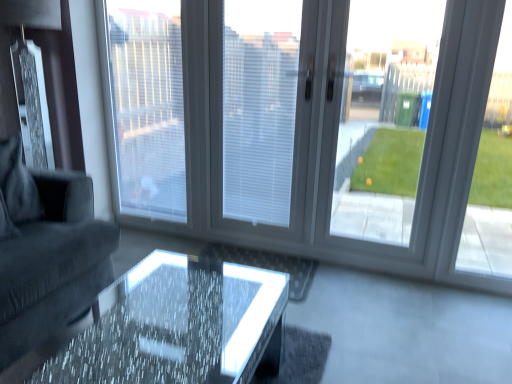
Question: Is transparent glass door at right, arranged as the 3th window screen when viewed from the left, facing away from dark gray fabric couch at left?

Choices:
 (A) no
 (B) yes

Answer: (A)

Question: Can you confirm if transparent glass door at right, arranged as the 3th window screen when viewed from the left, is bigger than dark gray fabric couch at left?

Choices:
 (A) yes
 (B) no

Answer: (B)

Question: Is transparent glass door at right, arranged as the 1th window screen when viewed from the right, wider than dark gray fabric couch at left?

Choices:
 (A) yes
 (B) no

Answer: (B)

Question: Can you confirm if transparent glass door at right, arranged as the 1th window screen when viewed from the right, is thinner than dark gray fabric couch at left?

Choices:
 (A) yes
 (B) no

Answer: (A)

Question: Is the surface of transparent glass door at right, arranged as the 3th window screen when viewed from the left, in direct contact with dark gray fabric couch at left?

Choices:
 (A) yes
 (B) no

Answer: (B)

Question: From the image's perspective, is white plastic window frame at right positioned above or below transparent glass door at right, arranged as the 1th window screen when viewed from the right?

Choices:
 (A) above
 (B) below

Answer: (B)

Question: In the image, is white plastic window frame at right on the left side or the right side of transparent glass door at right, arranged as the 3th window screen when viewed from the left?

Choices:
 (A) left
 (B) right

Answer: (B)

Question: Looking at the image, does white plastic window frame at right seem bigger or smaller compared to transparent glass door at right, arranged as the 1th window screen when viewed from the right?

Choices:
 (A) small
 (B) big

Answer: (A)

Question: Would you say white plastic window frame at right is inside or outside transparent glass door at right, arranged as the 1th window screen when viewed from the right?

Choices:
 (A) outside
 (B) inside

Answer: (A)

Question: Does point (103, 349) appear closer or farther from the camera than point (115, 49)?

Choices:
 (A) farther
 (B) closer

Answer: (B)

Question: In the image, is translucent glass table at center on the left side or the right side of white textured blinds at center, positioned as the 1th window screen in left-to-right order?

Choices:
 (A) left
 (B) right

Answer: (B)

Question: From the image's perspective, is translucent glass table at center located above or below white textured blinds at center, positioned as the 3th window screen in right-to-left order?

Choices:
 (A) above
 (B) below

Answer: (B)

Question: Considering their positions, is translucent glass table at center located in front of or behind white textured blinds at center, positioned as the 3th window screen in right-to-left order?

Choices:
 (A) front
 (B) behind

Answer: (A)

Question: Is white textured blinds at center, positioned as the 3th window screen in right-to-left order, in front of or behind white plastic window frame at right in the image?

Choices:
 (A) behind
 (B) front

Answer: (A)

Question: Would you say white textured blinds at center, positioned as the 3th window screen in right-to-left order, is to the left or to the right of white plastic window frame at right in the picture?

Choices:
 (A) left
 (B) right

Answer: (A)